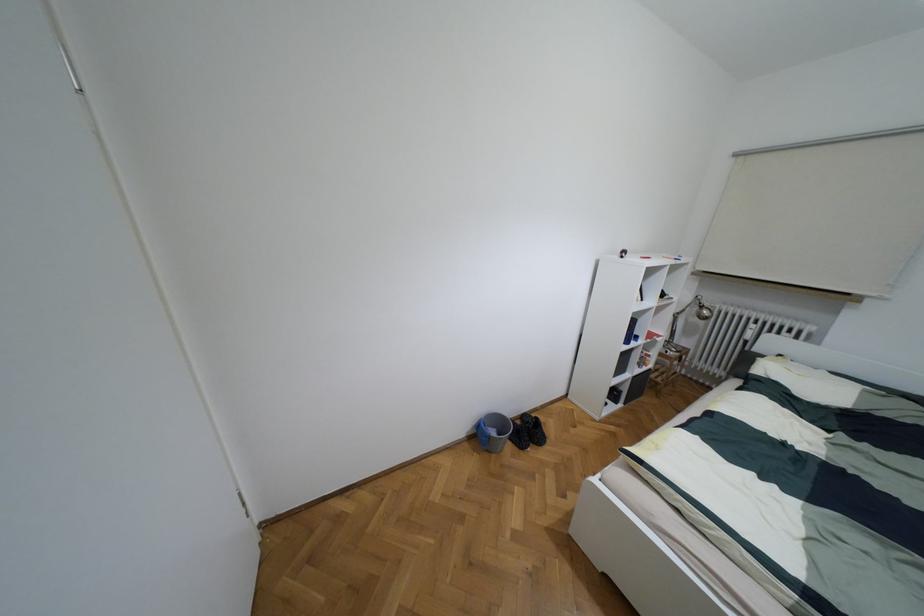
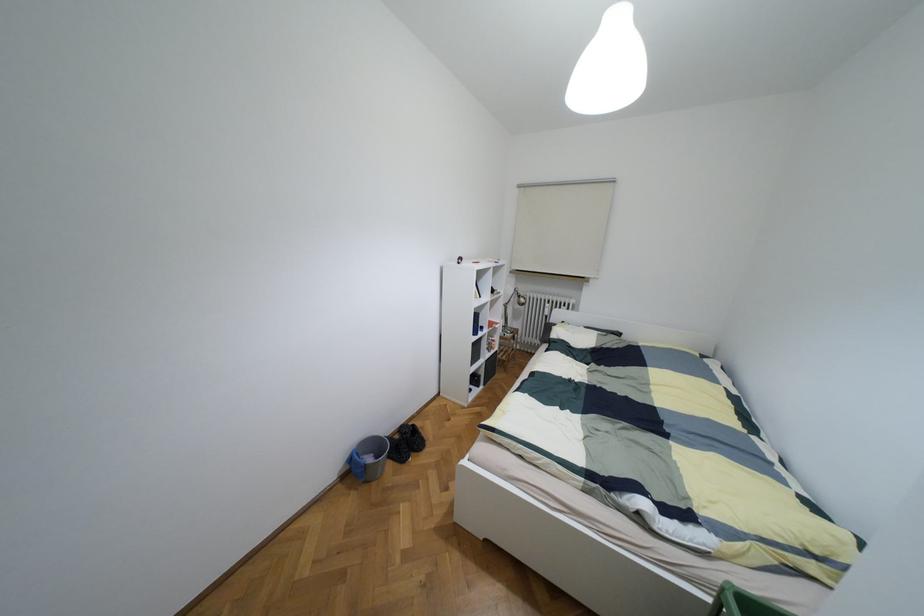
Question: The camera is either moving clockwise (left) or counter-clockwise (right) around the object. The first image is from the beginning of the video and the second image is from the end. Is the camera moving left or right when shooting the video?

Choices:
 (A) Left
 (B) Right

Answer: (A)